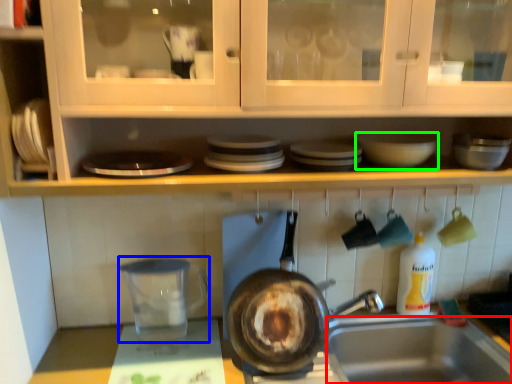
Question: Based on their relative distances, which object is nearer to sink (highlighted by a red box)? Choose from appliance (highlighted by a blue box) and basin (highlighted by a green box).

Choices:
 (A) appliance
 (B) basin

Answer: (A)